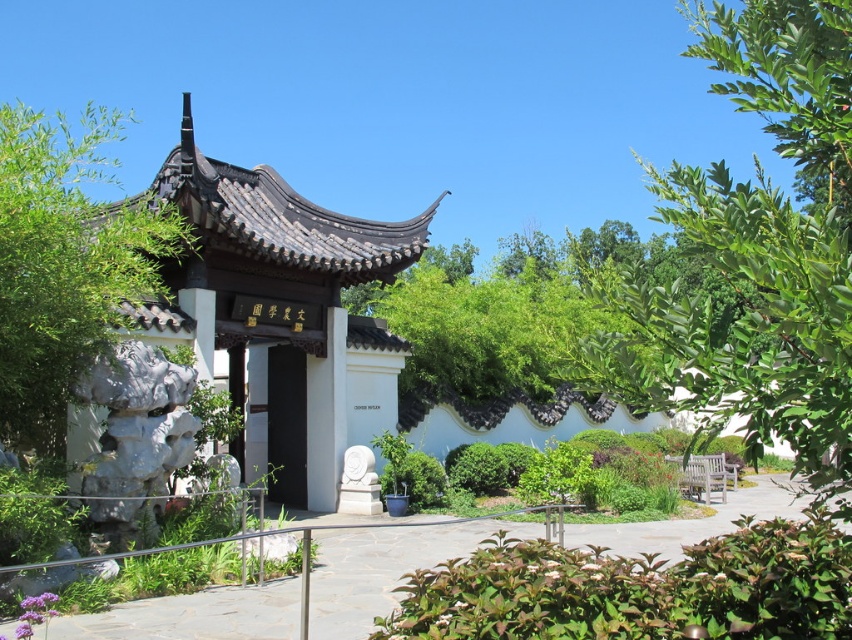
Question: Which object is farther from the camera taking this photo?

Choices:
 (A) smooth stone pathway at center
 (B) green leafy tree at left
 (C) green leafy tree at upper right

Answer: (B)

Question: Where is white matte gazebo at center located in relation to black matte door at center in the image?

Choices:
 (A) above
 (B) below

Answer: (B)

Question: Is white matte gazebo at center wider than green leafy tree at left?

Choices:
 (A) no
 (B) yes

Answer: (A)

Question: Does green leafy tree at upper right appear under green leafy tree at left?

Choices:
 (A) no
 (B) yes

Answer: (B)

Question: Which object is closer to the camera taking this photo?

Choices:
 (A) green leafy tree at upper right
 (B) green leafy tree at left
 (C) white matte gazebo at center

Answer: (A)

Question: Estimate the real-world distances between objects in this image. Which object is closer to the smooth stone pathway at center?

Choices:
 (A) green leafy tree at left
 (B) black matte door at center

Answer: (B)